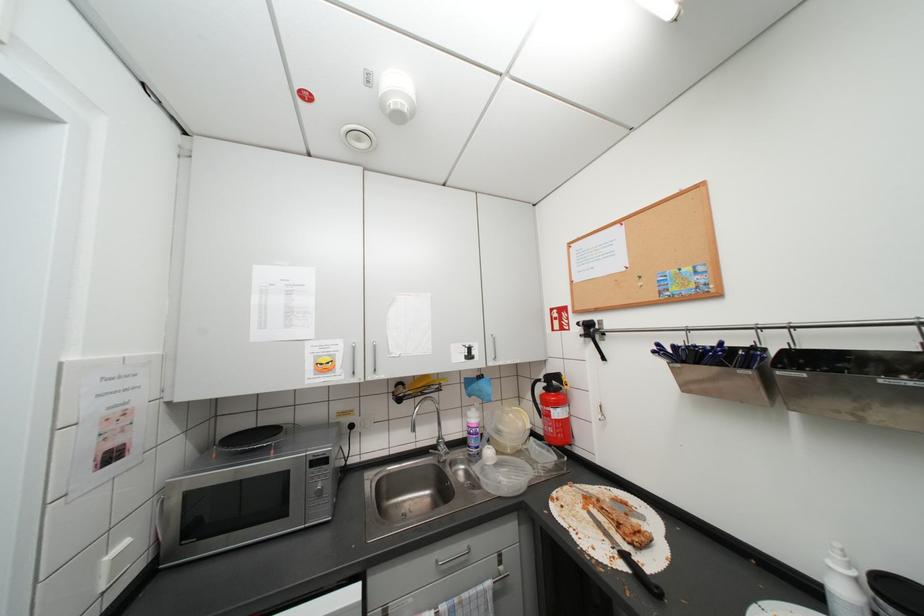
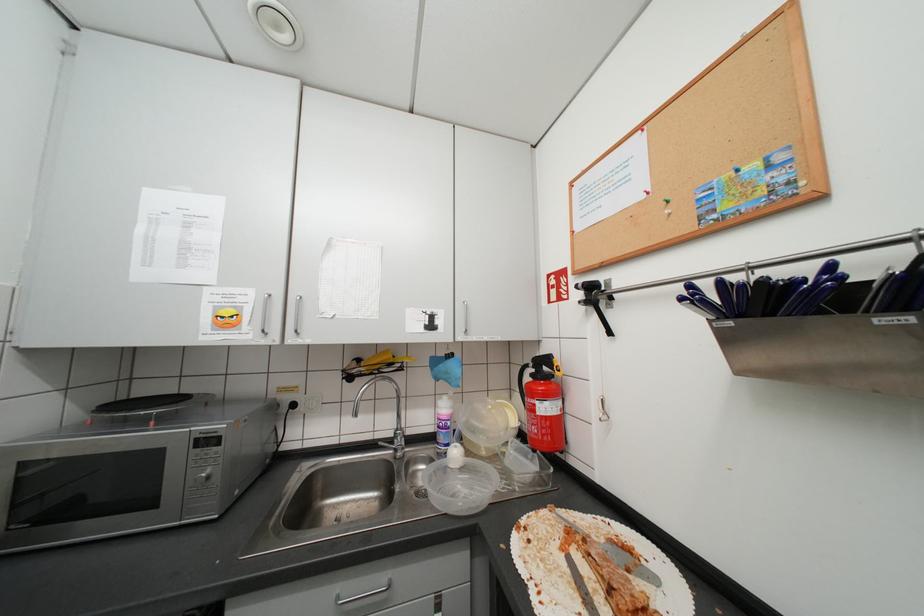
Question: How did the camera likely rotate?

Choices:
 (A) Left
 (B) Right
 (C) Up
 (D) Down

Answer: (A)